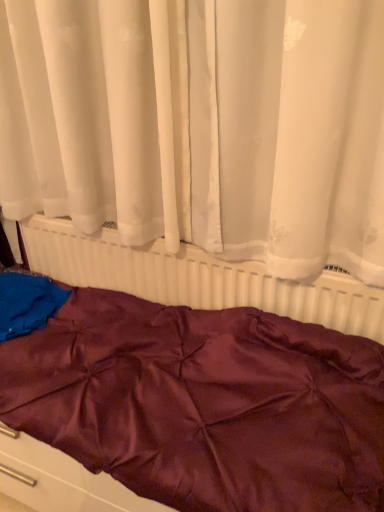
Question: Considering the relative positions of burgundy satin bedspread at center and white sheer curtain at upper center in the image provided, is burgundy satin bedspread at center to the left of white sheer curtain at upper center from the viewer's perspective?

Choices:
 (A) yes
 (B) no

Answer: (A)

Question: Could you tell me if burgundy satin bedspread at center is turned towards white sheer curtain at upper center?

Choices:
 (A) yes
 (B) no

Answer: (B)

Question: Considering the relative sizes of burgundy satin bedspread at center and white sheer curtain at upper center in the image provided, is burgundy satin bedspread at center thinner than white sheer curtain at upper center?

Choices:
 (A) no
 (B) yes

Answer: (A)

Question: Would you say burgundy satin bedspread at center is outside white sheer curtain at upper center?

Choices:
 (A) no
 (B) yes

Answer: (B)

Question: From the image's perspective, is burgundy satin bedspread at center above white sheer curtain at upper center?

Choices:
 (A) no
 (B) yes

Answer: (A)

Question: Is burgundy satin bedspread at center bigger than white sheer curtain at upper center?

Choices:
 (A) yes
 (B) no

Answer: (B)

Question: Is white sheer curtain at upper center beside burgundy satin bedspread at center?

Choices:
 (A) no
 (B) yes

Answer: (A)

Question: Considering the relative sizes of white sheer curtain at upper center and burgundy satin bedspread at center in the image provided, is white sheer curtain at upper center thinner than burgundy satin bedspread at center?

Choices:
 (A) yes
 (B) no

Answer: (A)

Question: Is white sheer curtain at upper center taller than burgundy satin bedspread at center?

Choices:
 (A) no
 (B) yes

Answer: (B)

Question: Does white sheer curtain at upper center have a greater width compared to burgundy satin bedspread at center?

Choices:
 (A) yes
 (B) no

Answer: (B)

Question: From the image's perspective, would you say white sheer curtain at upper center is positioned over burgundy satin bedspread at center?

Choices:
 (A) no
 (B) yes

Answer: (B)

Question: From the image's perspective, does white sheer curtain at upper center appear lower than burgundy satin bedspread at center?

Choices:
 (A) no
 (B) yes

Answer: (A)

Question: From the image's perspective, does white plastic radiator at center appear lower than burgundy satin bedspread at center?

Choices:
 (A) no
 (B) yes

Answer: (A)